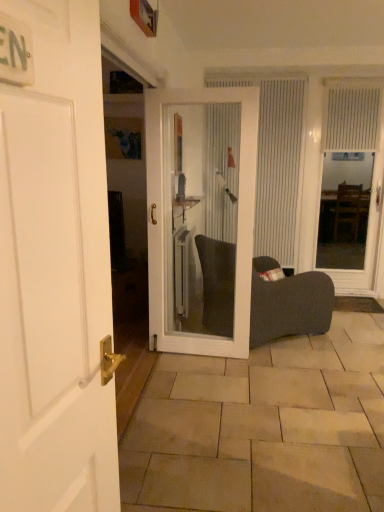
I want to click on vacant space to the right of white glossy door at center, which appears as the second door when viewed from the front, so click(x=269, y=366).